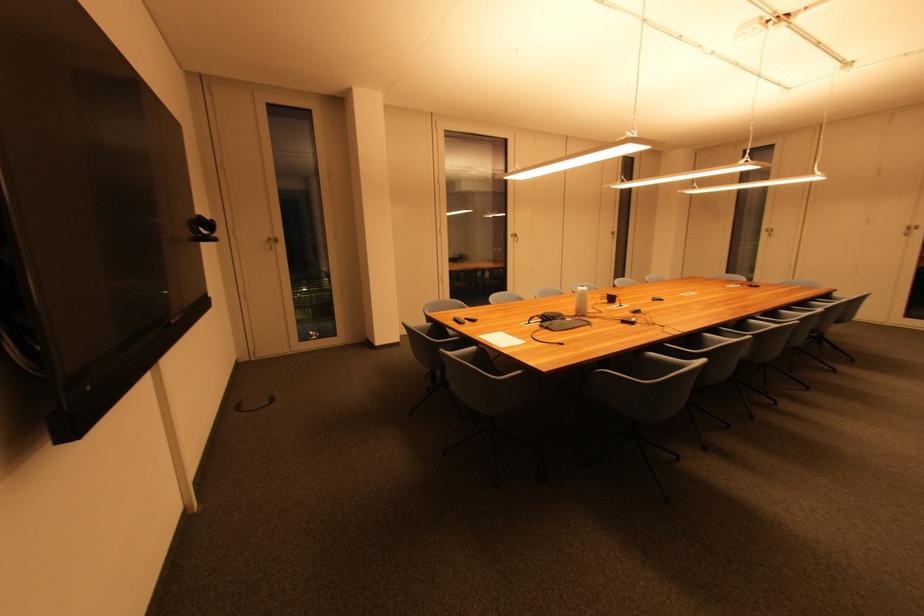
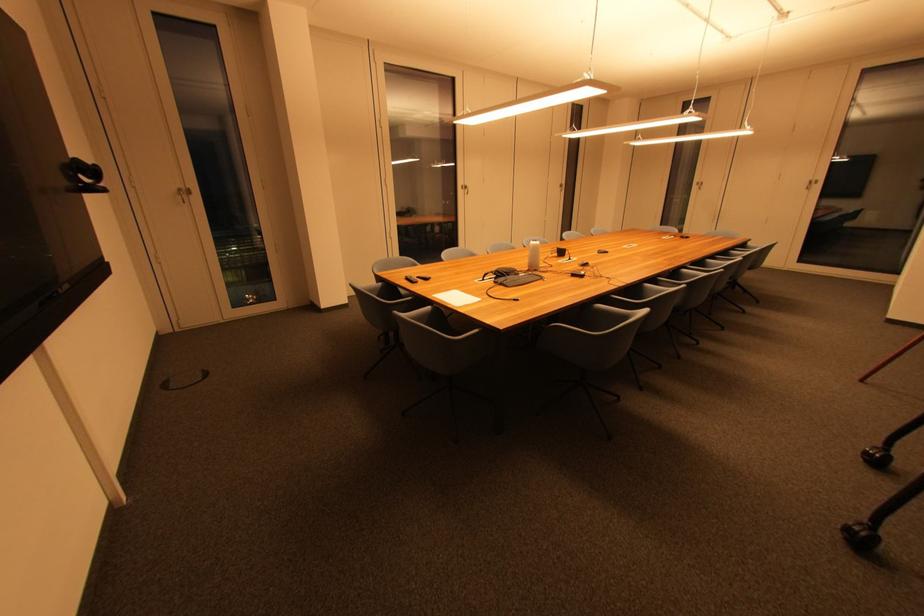
Question: I am providing you with two images of the same scene from different viewpoints. After the viewpoint changes to image2, which objects are now occluded?

Choices:
 (A) gray chair sitting surface
 (B) conference phone handset
 (C) black remote control
 (D) none of these

Answer: (D)